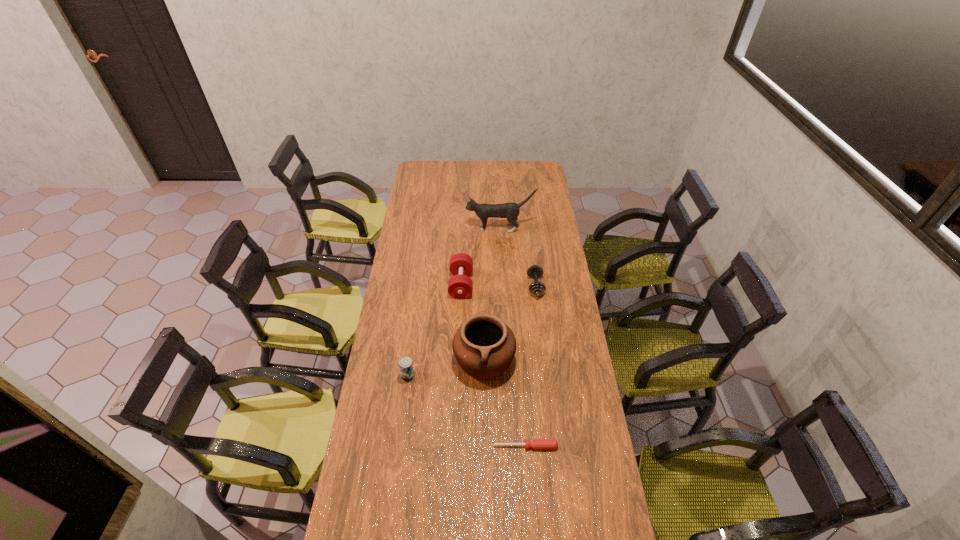
Where is `screwdriver situated at the right edge`? This screenshot has height=540, width=960. screwdriver situated at the right edge is located at coordinates (535, 443).

Identify the location of free space at the left edge. (424, 189).

Find the location of a particular element. The image size is (960, 540). vacant area at the right edge is located at coordinates (561, 269).

Locate an element on the screen. free location at the far right corner is located at coordinates (548, 174).

Locate an element on the screen. free area in between the pottery and the screwdriver is located at coordinates (505, 403).

The height and width of the screenshot is (540, 960). Identify the location of free space between the left dumbbell and the leftmost object. tap(435, 330).

The width and height of the screenshot is (960, 540). Identify the location of vacant space in between the nearest object and the second tallest object. (505, 403).

Find the location of a particular element. vacant point located between the shortest object and the fifth shortest object is located at coordinates (505, 403).

Locate an element on the screen. Image resolution: width=960 pixels, height=540 pixels. vacant space that's between the nearest object and the pottery is located at coordinates (x=505, y=403).

Identify the location of free point between the tallest object and the beer can. (454, 302).